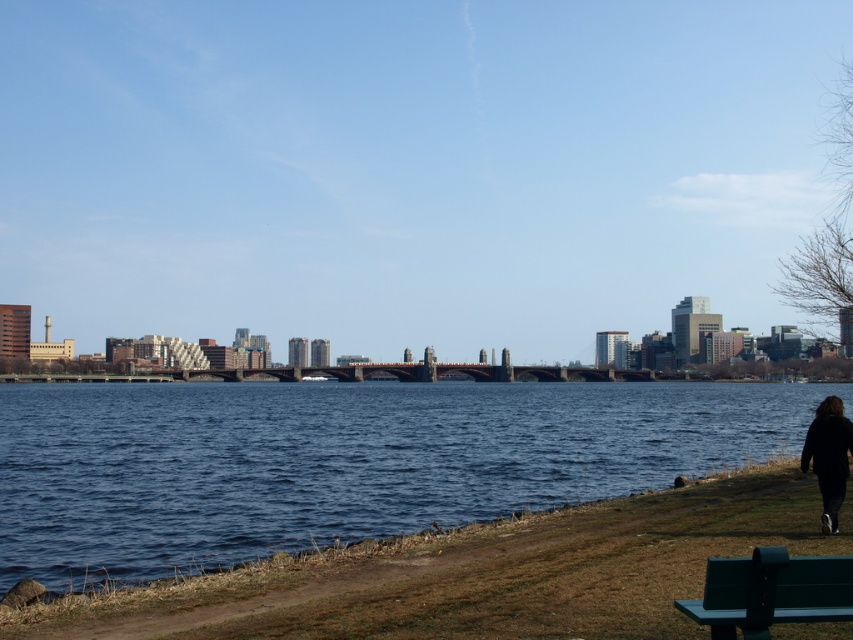
You are a photographer standing at the riverside scene. You want to take a photo of the green painted wood park bench at lower right and the black fabric jacket at lower right. Which object should you focus on first to ensure both are in sharp focus?

The green painted wood park bench at lower right is closer to the viewer than the black fabric jacket at lower right. To ensure both are in sharp focus, focus on the green painted wood park bench at lower right first since it is closer, and the jacket will fall into the depth of field behind it.

You are standing on the riverside and want to know if the blue water at center is bigger than the black fabric jacket at lower right. Can you tell me based on the scene?

The blue water at center has a larger size compared to the black fabric jacket at lower right, so yes, the blue water at center is bigger than the black fabric jacket at lower right.